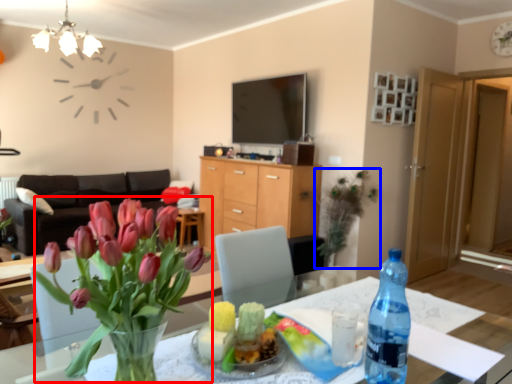
Question: Which of the following is the closest to the observer, floral arrangement (highlighted by a red box) or houseplant (highlighted by a blue box)?

Choices:
 (A) floral arrangement
 (B) houseplant

Answer: (A)